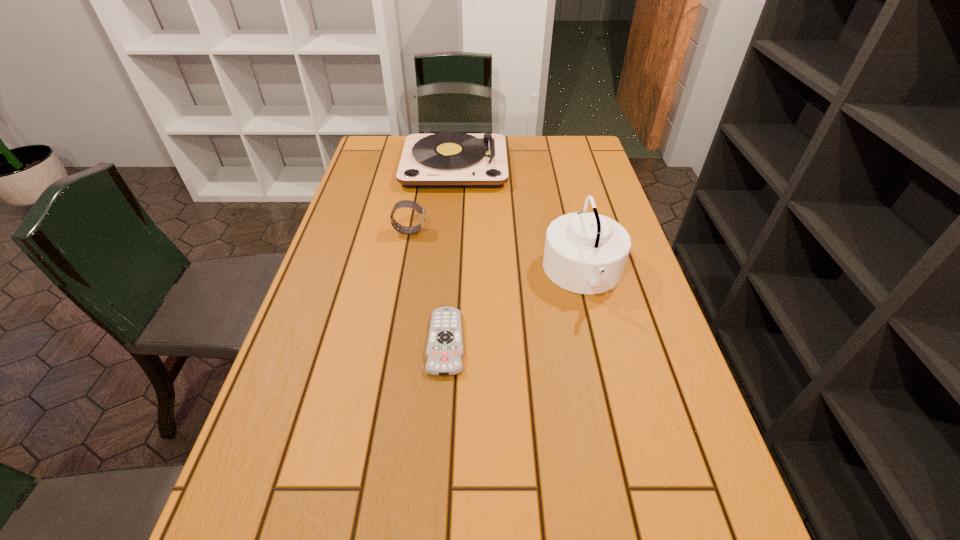
In the image, there is a desktop. Where is `vacant region at the right edge`? vacant region at the right edge is located at coordinates (606, 375).

What are the coordinates of `free space at the far right corner of the desktop` in the screenshot? It's located at (569, 136).

Where is `unoccupied area between the third nearest object and the kettle`? The width and height of the screenshot is (960, 540). unoccupied area between the third nearest object and the kettle is located at coordinates (496, 252).

Locate an element on the screen. free area in between the tallest object and the rightmost object is located at coordinates (519, 219).

Where is `vacant region between the third shortest object and the watch`? The width and height of the screenshot is (960, 540). vacant region between the third shortest object and the watch is located at coordinates (496, 252).

The width and height of the screenshot is (960, 540). I want to click on blank region between the farthest object and the second shortest object, so click(432, 197).

In order to click on free spot between the shortest object and the second farthest object in this screenshot , I will do [428, 286].

Image resolution: width=960 pixels, height=540 pixels. Identify the location of empty location between the second shortest object and the shortest object. (428, 286).

In order to click on free area in between the third shortest object and the farthest object in this screenshot , I will do `click(519, 219)`.

Find the location of a particular element. The height and width of the screenshot is (540, 960). the closest object relative to the third tallest object is located at coordinates (450, 159).